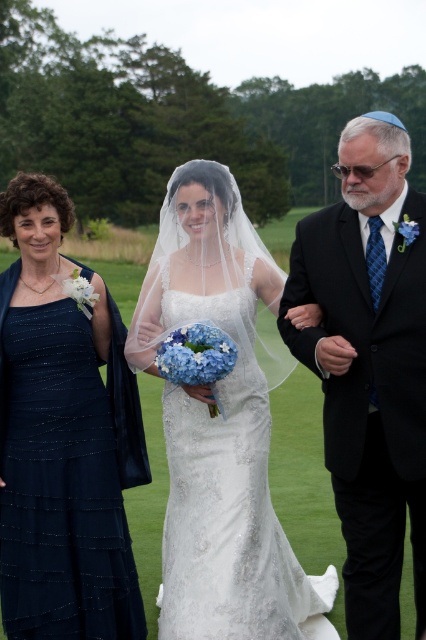
Question: Considering the relative positions of white lace dress at center and black satin suit at right in the image provided, where is white lace dress at center located with respect to black satin suit at right?

Choices:
 (A) below
 (B) above

Answer: (A)

Question: Can you confirm if white lace dress at center is bigger than black satin suit at right?

Choices:
 (A) yes
 (B) no

Answer: (A)

Question: Based on their relative distances, which object is farther from the black satin suit at right?

Choices:
 (A) white lace dress at center
 (B) navy satin dress at left

Answer: (B)

Question: Which object is positioned closest to the navy satin dress at left?

Choices:
 (A) black satin suit at right
 (B) white lace dress at center

Answer: (B)

Question: Does navy satin dress at left have a larger size compared to black satin suit at right?

Choices:
 (A) yes
 (B) no

Answer: (A)

Question: Which object appears farthest from the camera in this image?

Choices:
 (A) white lace dress at center
 (B) navy satin dress at left
 (C) black satin suit at right

Answer: (B)